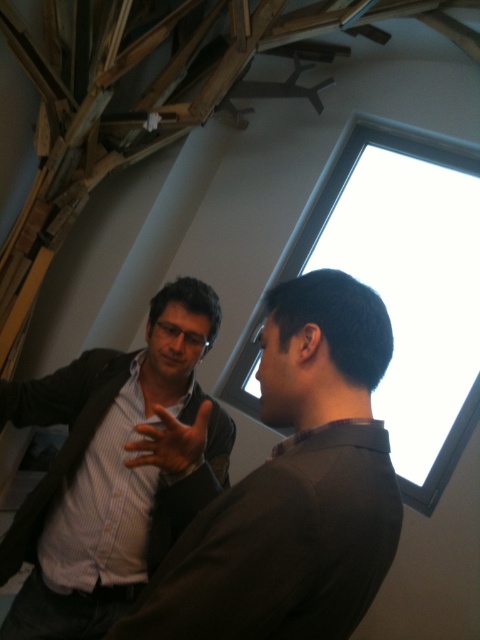
This screenshot has height=640, width=480. Describe the element at coordinates (115, 468) in the screenshot. I see `matte black shirt at center` at that location.

Between point (82, 412) and point (204, 406), which one is positioned in front?

Point (204, 406) is more forward.

At what (x,y) coordinates should I click in order to perform the action: click on matte black shirt at center. Please return your answer as a coordinate pair (x, y). The image size is (480, 640). Looking at the image, I should click on (115, 468).

Find the location of a particular element. The height and width of the screenshot is (640, 480). dark brown shirt at center is located at coordinates (294, 488).

Between point (357, 368) and point (162, 451), which one is positioned in front?

Point (357, 368) is in front.

In order to click on dark brown shirt at center in this screenshot , I will do `click(294, 488)`.

Which is in front, point (331, 502) or point (169, 410)?

Point (331, 502)

Image resolution: width=480 pixels, height=640 pixels. What do you see at coordinates (294, 488) in the screenshot? I see `dark brown shirt at center` at bounding box center [294, 488].

You are a GUI agent. You are given a task and a screenshot of the screen. Output one action in this format:
    pyautogui.click(x=<x>, y=<y>)
    Task: Click on the dark brown shirt at center
    This screenshot has height=640, width=480.
    Given the screenshot: What is the action you would take?
    pyautogui.click(x=294, y=488)